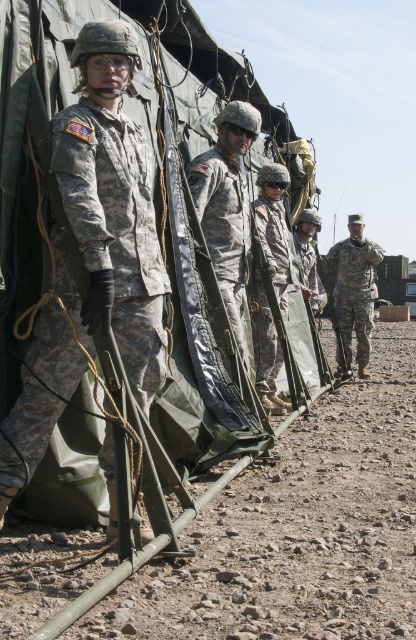
Question: Does camouflage fabric uniform at center come in front of camouflage fabric helmet at center?

Choices:
 (A) yes
 (B) no

Answer: (A)

Question: Among these objects, which one is farthest from the camera?

Choices:
 (A) camouflage uniform at right
 (B) camouflage fabric uniform at left

Answer: (A)

Question: Among these points, which one is nearest to the camera?

Choices:
 (A) (364, 324)
 (B) (267, 516)
 (C) (146, 188)
 (D) (269, 397)

Answer: (C)

Question: Is camouflage fabric uniform at left smaller than camouflage fabric uniform at center?

Choices:
 (A) yes
 (B) no

Answer: (A)

Question: Considering the relative positions of dusty gravel ground at lower right and camouflage fabric helmet at center in the image provided, where is dusty gravel ground at lower right located with respect to camouflage fabric helmet at center?

Choices:
 (A) right
 (B) left

Answer: (A)

Question: Which point appears farthest from the camera in this image?

Choices:
 (A) (400, 556)
 (B) (366, 296)

Answer: (B)